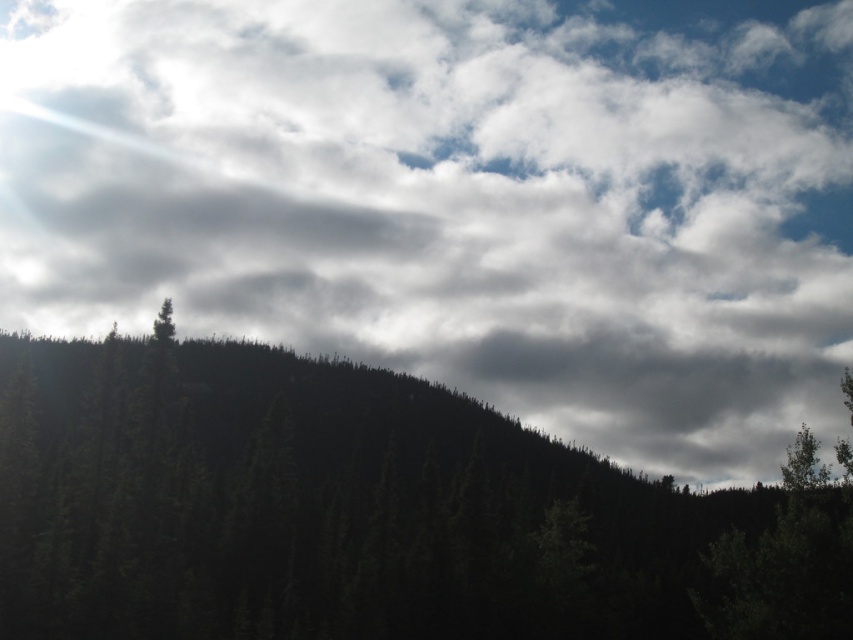
You are hiking through the forest and want to reach a clearing ahead. You notice the dark green textured trees at center and the green matte tree at lower right. Which tree group is closer to you, and how might this affect your path?

The dark green textured trees at center are closer to you than the green matte tree at lower right. This means the path might be more obstructed near you, so you should plan your route around the closer trees first before moving toward the farther ones.

You are a hiker trying to navigate through the forest. You see the dark green textured trees at center and the green matte tree at upper left. Which of these two trees is positioned lower in the scene?

The dark green textured trees at center is located below the green matte tree at upper left, so it is positioned lower in the scene.

You are a hiker trying to navigate through the forest. You notice two trees in your path. One is the dark green textured trees at center and the other is the green matte tree at upper left. Which tree is taller?

The dark green textured trees at center is much taller than the green matte tree at upper left.